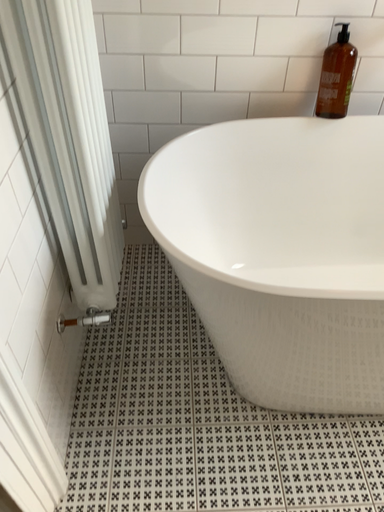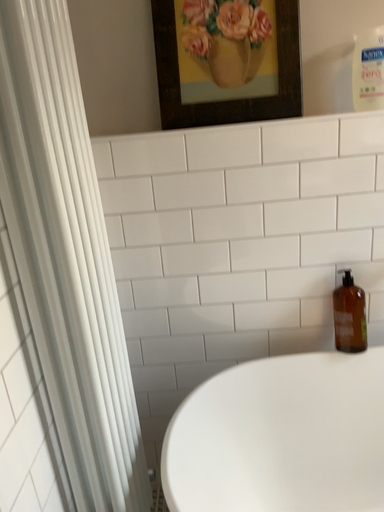
Question: How did the camera likely rotate when shooting the video?

Choices:
 (A) rotated upward
 (B) rotated downward

Answer: (A)